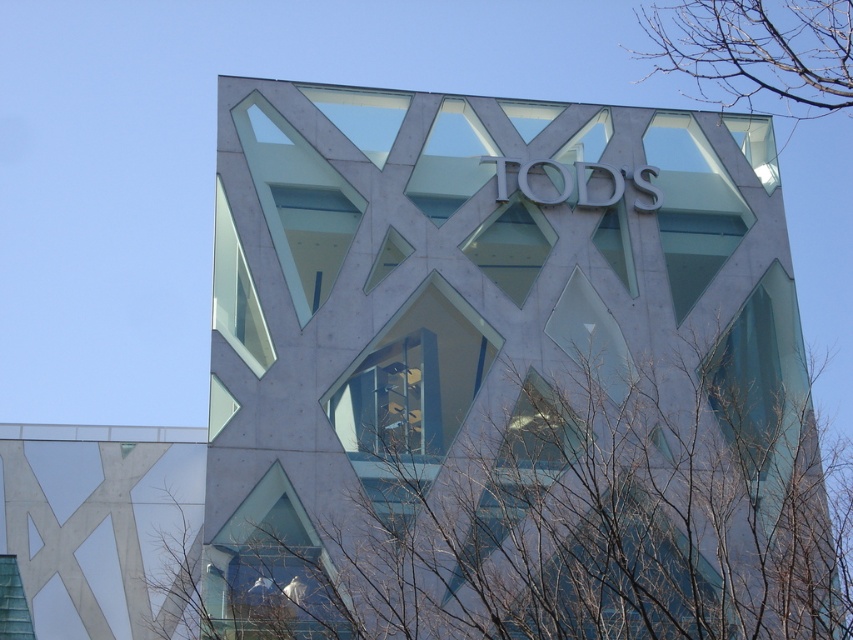
Is bare branches at lower left positioned behind bare branches at upper right?

No, it is not.

Who is positioned more to the right, bare branches at lower left or bare branches at upper right?

bare branches at upper right is more to the right.

Who is more forward, (520, 406) or (755, 51)?

Point (520, 406) is in front.

What are the coordinates of `bare branches at lower left` in the screenshot? It's located at (561, 513).